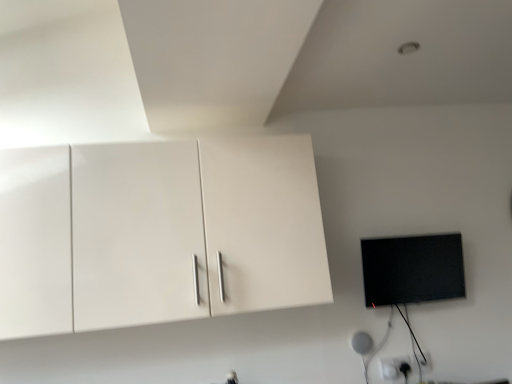
Where is `black glossy flat screen tv at right`? black glossy flat screen tv at right is located at coordinates (412, 269).

The width and height of the screenshot is (512, 384). What do you see at coordinates (412, 269) in the screenshot? I see `black glossy flat screen tv at right` at bounding box center [412, 269].

Locate an element on the screen. The height and width of the screenshot is (384, 512). white glossy cabinet at upper left is located at coordinates (158, 233).

What do you see at coordinates (158, 233) in the screenshot?
I see `white glossy cabinet at upper left` at bounding box center [158, 233].

Identify the location of black glossy flat screen tv at right. The height and width of the screenshot is (384, 512). (412, 269).

Visually, is black glossy flat screen tv at right positioned to the left or to the right of white glossy cabinet at upper left?

black glossy flat screen tv at right is to the right of white glossy cabinet at upper left.

Does black glossy flat screen tv at right come in front of white glossy cabinet at upper left?

No, black glossy flat screen tv at right is behind white glossy cabinet at upper left.

Is point (378, 244) more distant than point (15, 225)?

Yes, it is behind point (15, 225).

From the image's perspective, which one is positioned higher, black glossy flat screen tv at right or white glossy cabinet at upper left?

white glossy cabinet at upper left.

From a real-world perspective, who is located lower, black glossy flat screen tv at right or white glossy cabinet at upper left?

black glossy flat screen tv at right.

Considering the sizes of black glossy flat screen tv at right and white glossy cabinet at upper left in the image, is black glossy flat screen tv at right wider or thinner than white glossy cabinet at upper left?

In the image, black glossy flat screen tv at right appears to be more narrow than white glossy cabinet at upper left.

Considering the relative sizes of black glossy flat screen tv at right and white glossy cabinet at upper left in the image provided, is black glossy flat screen tv at right shorter than white glossy cabinet at upper left?

Correct, black glossy flat screen tv at right is not as tall as white glossy cabinet at upper left.

Is black glossy flat screen tv at right smaller than white glossy cabinet at upper left?

Indeed, black glossy flat screen tv at right has a smaller size compared to white glossy cabinet at upper left.

Would you say white glossy cabinet at upper left is part of black glossy flat screen tv at right's contents?

That's incorrect, white glossy cabinet at upper left is not inside black glossy flat screen tv at right.

Is black glossy flat screen tv at right in contact with white glossy cabinet at upper left?

No, black glossy flat screen tv at right is not beside white glossy cabinet at upper left.

Is black glossy flat screen tv at right turned away from white glossy cabinet at upper left?

No, black glossy flat screen tv at right is not facing the opposite direction of white glossy cabinet at upper left.

Locate an element on the screen. The width and height of the screenshot is (512, 384). cabinetry on the left of black glossy flat screen tv at right is located at coordinates (158, 233).

Between white glossy cabinet at upper left and black glossy flat screen tv at right, which one appears on the right side from the viewer's perspective?

black glossy flat screen tv at right is more to the right.

Relative to black glossy flat screen tv at right, is white glossy cabinet at upper left in front or behind?

white glossy cabinet at upper left is in front of black glossy flat screen tv at right.

Is point (303, 243) closer to camera compared to point (376, 279)?

That is True.

From the image's perspective, which one is positioned higher, white glossy cabinet at upper left or black glossy flat screen tv at right?

white glossy cabinet at upper left appears higher in the image.

From a real-world perspective, between white glossy cabinet at upper left and black glossy flat screen tv at right, who is vertically lower?

black glossy flat screen tv at right, from a real-world perspective.

Does white glossy cabinet at upper left have a greater width compared to black glossy flat screen tv at right?

Yes.

Which of these two, white glossy cabinet at upper left or black glossy flat screen tv at right, stands taller?

With more height is white glossy cabinet at upper left.

Considering the sizes of objects white glossy cabinet at upper left and black glossy flat screen tv at right in the image provided, who is bigger, white glossy cabinet at upper left or black glossy flat screen tv at right?

→ With larger size is white glossy cabinet at upper left.

Would you say white glossy cabinet at upper left is outside black glossy flat screen tv at right?

Absolutely, white glossy cabinet at upper left is external to black glossy flat screen tv at right.

Is white glossy cabinet at upper left next to black glossy flat screen tv at right and touching it?

No, white glossy cabinet at upper left is not beside black glossy flat screen tv at right.

Is white glossy cabinet at upper left looking in the opposite direction of black glossy flat screen tv at right?

No.

In the scene shown: How different are the orientations of white glossy cabinet at upper left and black glossy flat screen tv at right in degrees?

The angular difference between white glossy cabinet at upper left and black glossy flat screen tv at right is 1.94 degrees.

The image size is (512, 384). I want to click on flat to the right of white glossy cabinet at upper left, so click(x=412, y=269).

Find the location of `flat behind the white glossy cabinet at upper left`. flat behind the white glossy cabinet at upper left is located at coordinates (412, 269).

The height and width of the screenshot is (384, 512). I want to click on flat below the white glossy cabinet at upper left (from the image's perspective), so click(x=412, y=269).